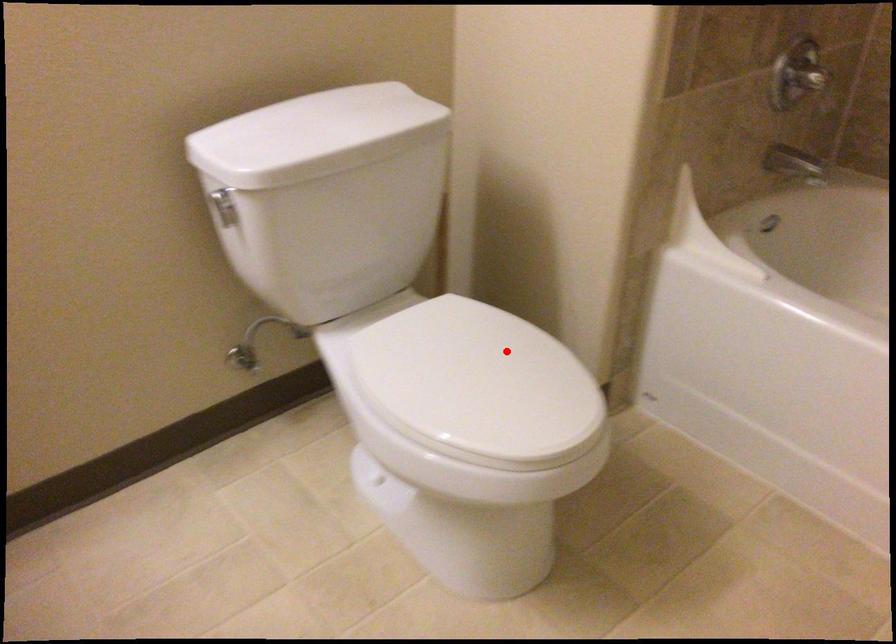
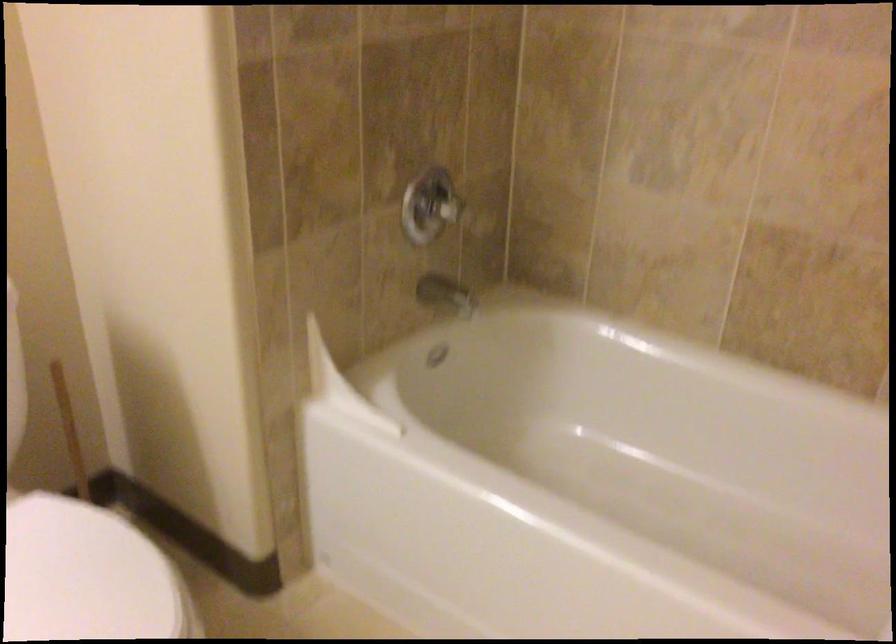
Locate, in the second image, the point that corresponds to the highlighted location in the first image.

(88, 576)